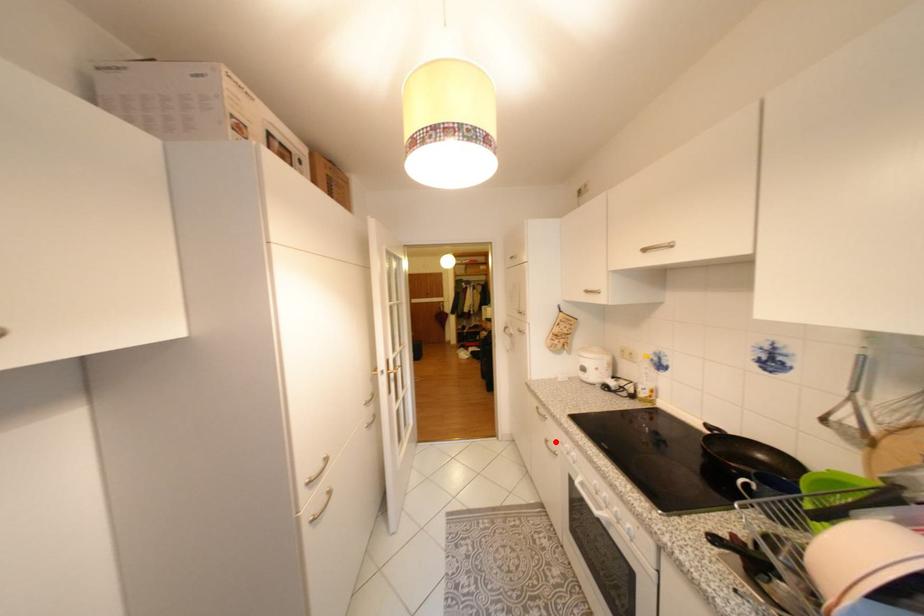
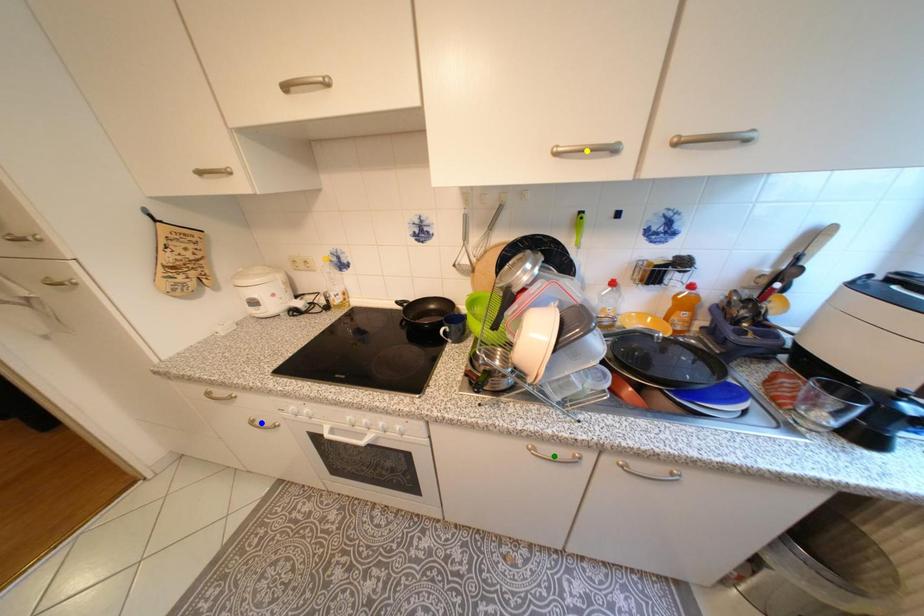
Question: I am providing you with two images of the same scene from different viewpoints. A red point is marked on the first image. You are given multiple points on the second image. In image 2, which mark is for the same physical point as the one in image 1?

Choices:
 (A) yellow point
 (B) blue point
 (C) green point

Answer: (B)